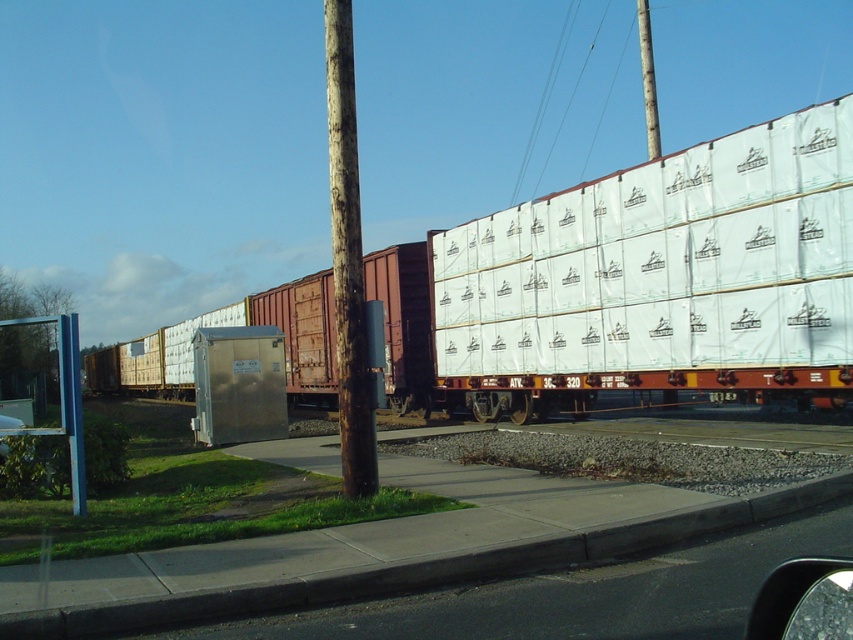
You are a maintenance worker inspecting the poles in the railway area. You notice two poles, the rusty wood pole at center and the brown wooden pole at upper center. Which pole is positioned to the left of the other?

The rusty wood pole at center is positioned to the left of the brown wooden pole at upper center.

You are a delivery person who needs to place a new utility box that is 1.2 meters wide. You see the white plastic containers at center and the rusty wood pole at center. Can the new utility box fit between them?

The white plastic containers at center might be wider than rusty wood pole at center, so the distance between them is uncertain. Without knowing the exact width of the containers and pole, it is impossible to determine if the 1.2 meter wide utility box can fit between them.